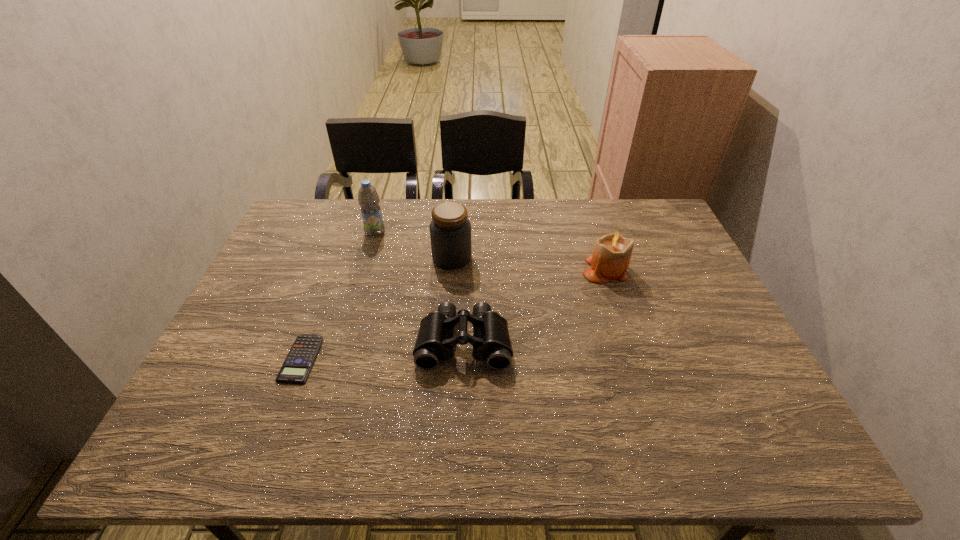
The width and height of the screenshot is (960, 540). What are the coordinates of `vacant area that lies between the jar and the farthest object` in the screenshot? It's located at (414, 245).

Locate an element on the screen. The image size is (960, 540). vacant region between the jar and the second shortest object is located at coordinates (458, 300).

You are a GUI agent. You are given a task and a screenshot of the screen. Output one action in this format:
    pyautogui.click(x=<x>, y=<y>)
    Task: Click on the empty location between the rightmost object and the jar
    The width and height of the screenshot is (960, 540).
    Given the screenshot: What is the action you would take?
    pyautogui.click(x=529, y=264)

I want to click on free space between the second object from left to right and the second shortest object, so click(420, 287).

You are a GUI agent. You are given a task and a screenshot of the screen. Output one action in this format:
    pyautogui.click(x=<x>, y=<y>)
    Task: Click on the free space between the water bottle and the third tallest object
    Image resolution: width=960 pixels, height=540 pixels.
    Given the screenshot: What is the action you would take?
    pyautogui.click(x=491, y=251)

Locate an element on the screen. The width and height of the screenshot is (960, 540). free space that is in between the binoculars and the calculator is located at coordinates 382,350.

The width and height of the screenshot is (960, 540). I want to click on free space between the fourth tallest object and the farthest object, so click(420, 287).

Identify which object is located as the nearest to the jar. Please provide its 2D coordinates. Your answer should be formatted as a tuple, i.e. [(x, y)], where the tuple contains the x and y coordinates of a point satisfying the conditions above.

[(368, 198)]

Identify which object is the second nearest to the jar. Please provide its 2D coordinates. Your answer should be formatted as a tuple, i.e. [(x, y)], where the tuple contains the x and y coordinates of a point satisfying the conditions above.

[(435, 341)]

Locate an element on the screen. Image resolution: width=960 pixels, height=540 pixels. free spot that satisfies the following two spatial constraints: 1. on the back side of the shortest object; 2. on the right side of the farthest object is located at coordinates (348, 232).